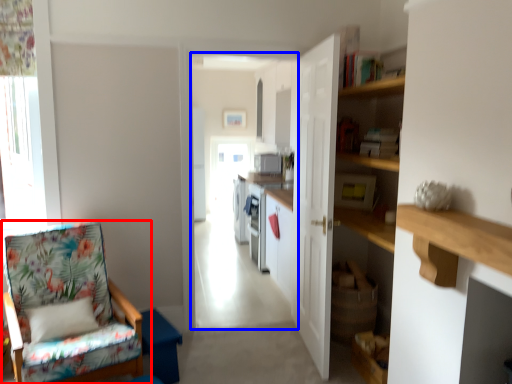
Question: Which object appears farthest to the camera in this image, chair (highlighted by a red box) or corridor (highlighted by a blue box)?

Choices:
 (A) chair
 (B) corridor

Answer: (B)